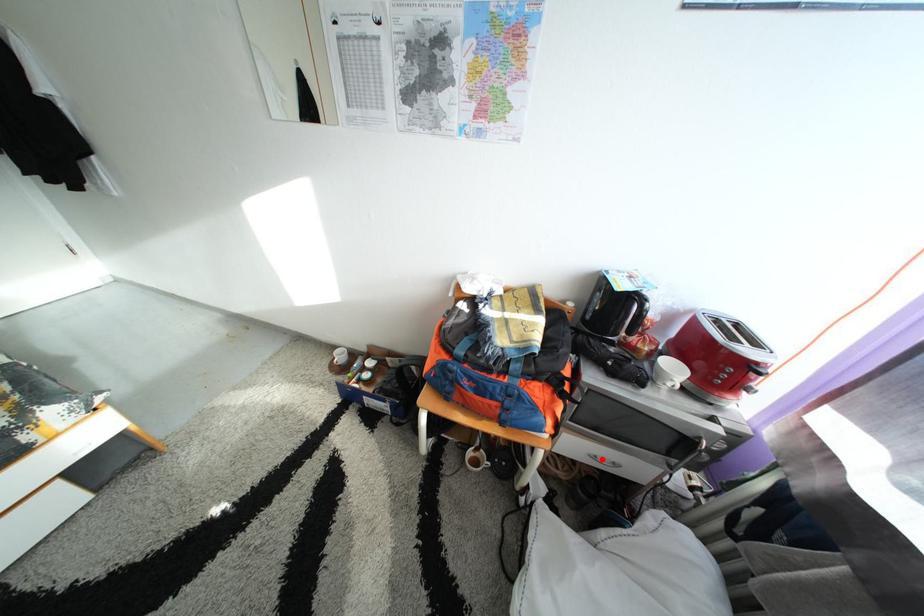
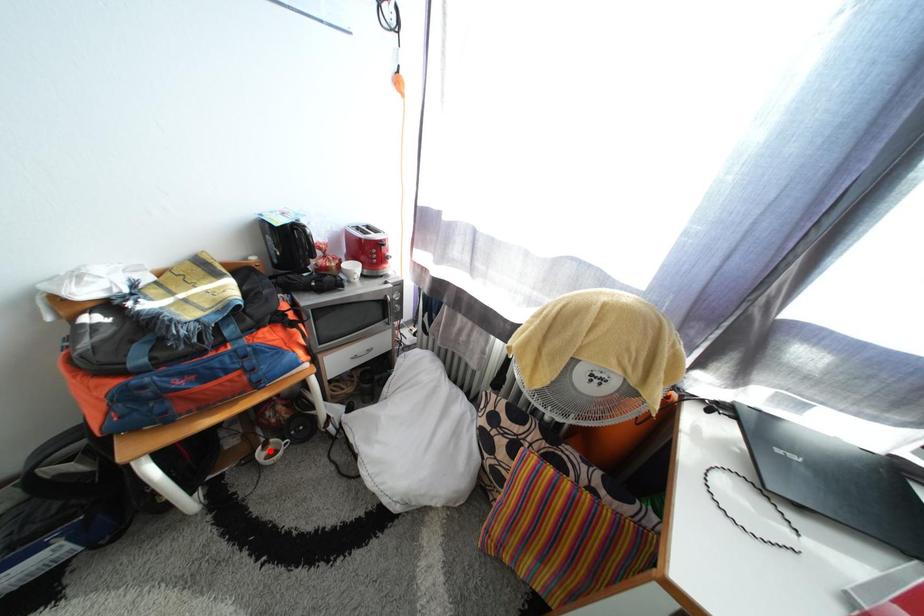
I am providing you with two images of the same scene from different viewpoints. A red point is marked on the first image and another point is marked on the second image. Is the marked point in image1 the same physical position as the marked point in image2?

No